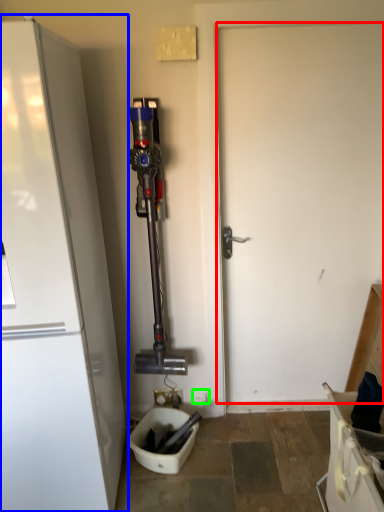
Question: Considering the real-world distances, which object is closest to door (highlighted by a red box)? refrigerator (highlighted by a blue box) or electric outlet (highlighted by a green box).

Choices:
 (A) refrigerator
 (B) electric outlet

Answer: (A)